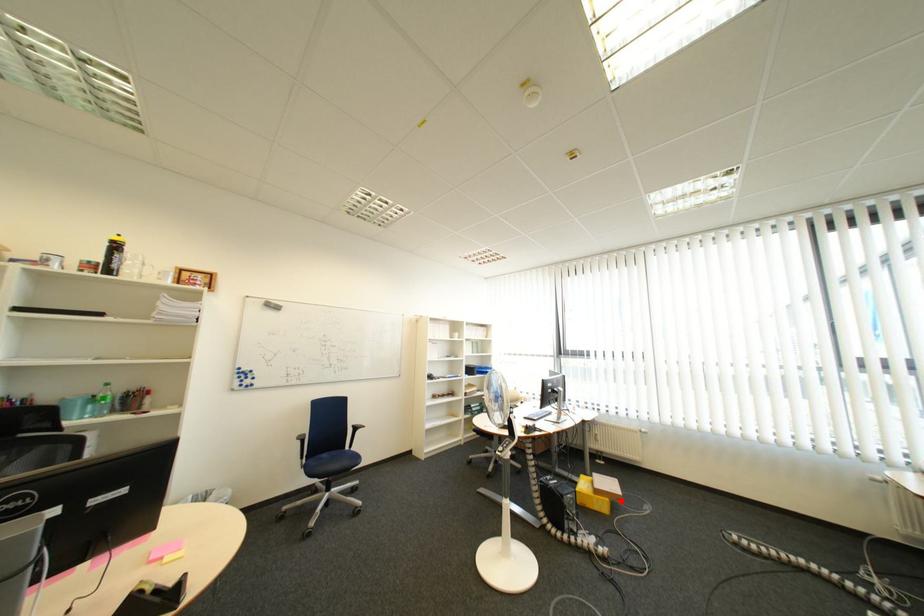
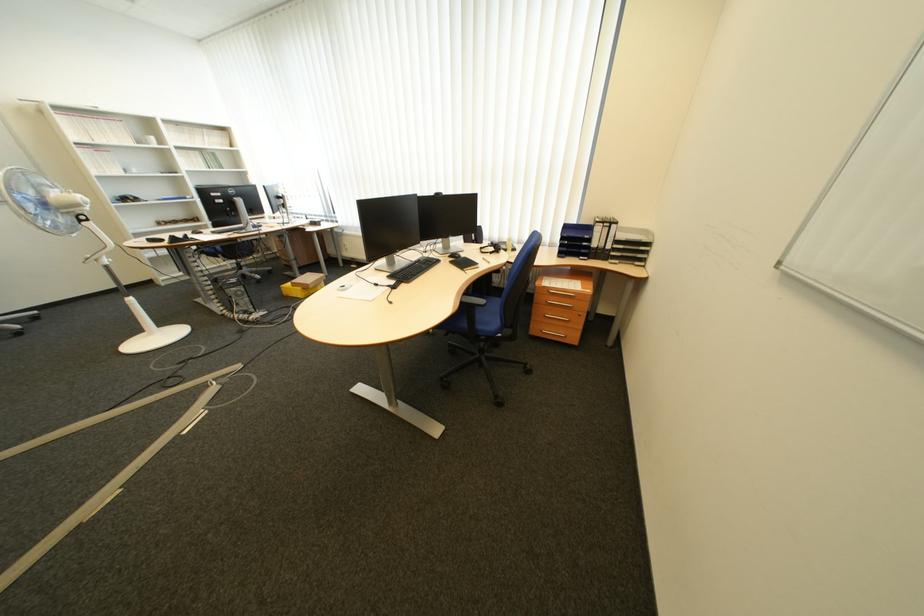
Where in the second image is the point corresponding to the highlighted location from the first image?

(313, 290)